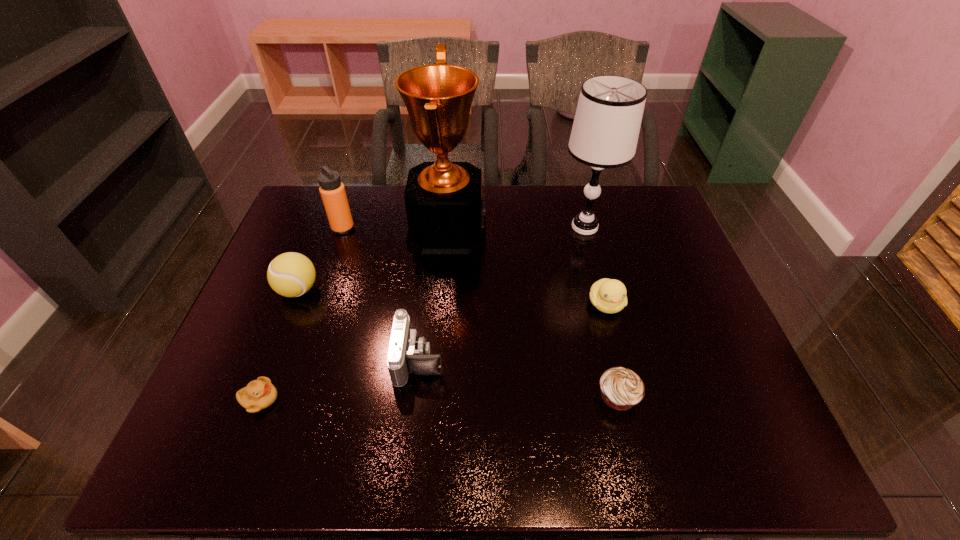
This screenshot has height=540, width=960. What are the coordinates of `trophy cup` in the screenshot? It's located at (445, 205).

The width and height of the screenshot is (960, 540). I want to click on table lamp, so click(606, 127).

You are a GUI agent. You are given a task and a screenshot of the screen. Output one action in this format:
    pyautogui.click(x=<x>, y=<y>)
    Task: Click on the thermos bottle
    Image resolution: width=960 pixels, height=540 pixels.
    Given the screenshot: What is the action you would take?
    pyautogui.click(x=333, y=194)

Image resolution: width=960 pixels, height=540 pixels. I want to click on tennis ball, so click(x=291, y=274).

Locate an element on the screen. This screenshot has width=960, height=540. camera is located at coordinates (407, 353).

What are the coordinates of `the right duckling` in the screenshot? It's located at (608, 295).

The image size is (960, 540). Identify the location of the farther duckling. (608, 295).

This screenshot has width=960, height=540. Find the location of `muffin`. muffin is located at coordinates (621, 389).

Find the location of a particular element. The image size is (960, 540). the left duckling is located at coordinates (259, 394).

In order to click on the nearer duckling in this screenshot , I will do point(259,394).